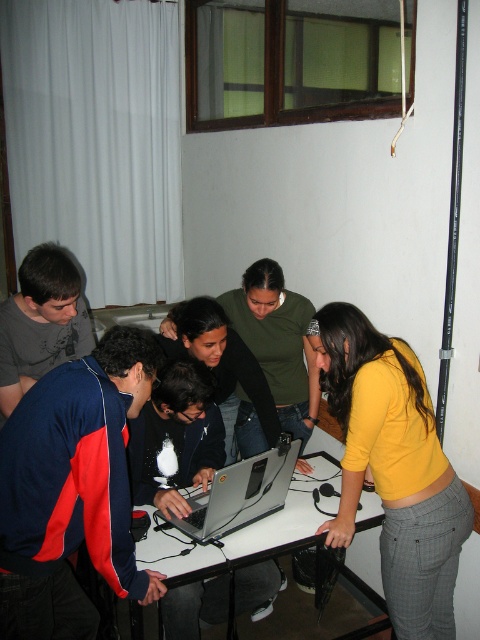
Does yellow matte shirt at center appear on the right side of silver metallic laptop at center?

Indeed, yellow matte shirt at center is positioned on the right side of silver metallic laptop at center.

Who is taller, yellow matte shirt at center or silver metallic laptop at center?

With more height is yellow matte shirt at center.

This screenshot has height=640, width=480. I want to click on yellow matte shirt at center, so pos(394,468).

The width and height of the screenshot is (480, 640). Identify the location of yellow matte shirt at center. (394, 468).

Between yellow matte shirt at center and white glossy table at center, which one has more height?

yellow matte shirt at center

This screenshot has width=480, height=640. Describe the element at coordinates (394, 468) in the screenshot. I see `yellow matte shirt at center` at that location.

Where is `yellow matte shirt at center`? yellow matte shirt at center is located at coordinates (394, 468).

Does white glossy table at center have a greater height compared to silver metallic laptop at center?

No, white glossy table at center is not taller than silver metallic laptop at center.

Based on the photo, who is more forward, (315, 540) or (275, 451)?

Point (315, 540) is in front.

This screenshot has width=480, height=640. I want to click on white glossy table at center, so click(277, 529).